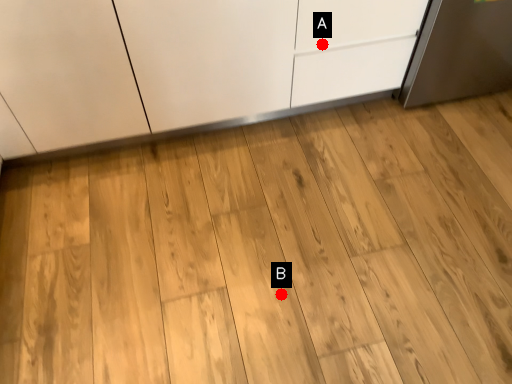
Question: Two points are circled on the image, labeled by A and B beside each circle. Which point is farther to the camera?

Choices:
 (A) A is further
 (B) B is further

Answer: (A)